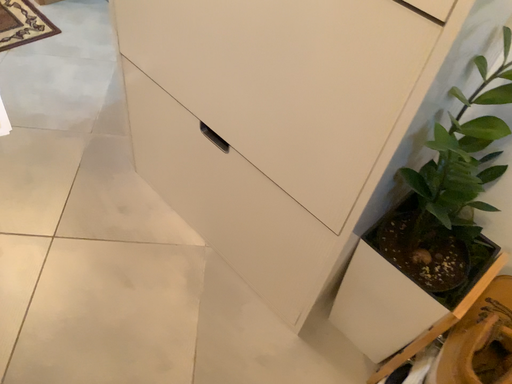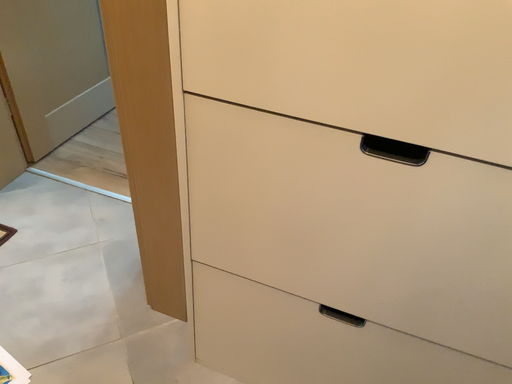
Question: How did the camera likely rotate when shooting the video?

Choices:
 (A) rotated upward
 (B) rotated downward

Answer: (A)